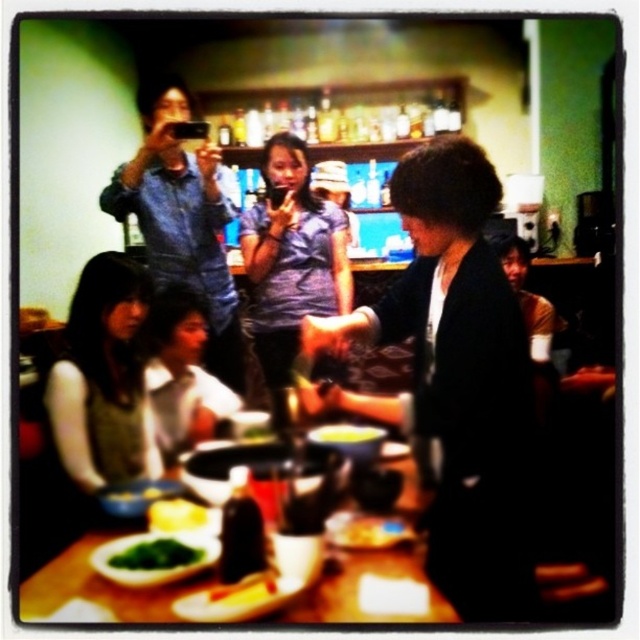
Find the location of a particular element. green matte plate at center is located at coordinates (371, 589).

Measure the distance between point (x=403, y=564) and camera.

Point (x=403, y=564) is 3.65 feet away from camera.

Image resolution: width=640 pixels, height=640 pixels. What do you see at coordinates (371, 589) in the screenshot? I see `green matte plate at center` at bounding box center [371, 589].

I want to click on green matte plate at center, so click(371, 589).

Can you confirm if white fabric shirt at lower left is positioned to the left of green leafy vegetable at table center?

Result: Yes, white fabric shirt at lower left is to the left of green leafy vegetable at table center.

Where is `white fabric shirt at lower left`? The width and height of the screenshot is (640, 640). white fabric shirt at lower left is located at coordinates (180, 372).

Where is `white fabric shirt at lower left`? white fabric shirt at lower left is located at coordinates (180, 372).

Does matte gray vest at lower left come in front of green leafy vegetable at table center?

Yes, matte gray vest at lower left is in front of green leafy vegetable at table center.

Does point (122, 280) lie in front of point (166, 481)?

No.

Between point (92, 378) and point (147, 496), which one is positioned in front?

Positioned in front is point (147, 496).

Locate an element on the screen. matte gray vest at lower left is located at coordinates (104, 380).